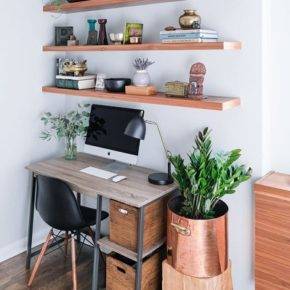
This screenshot has height=290, width=290. In order to click on computer screen in this screenshot , I will do `click(110, 133)`.